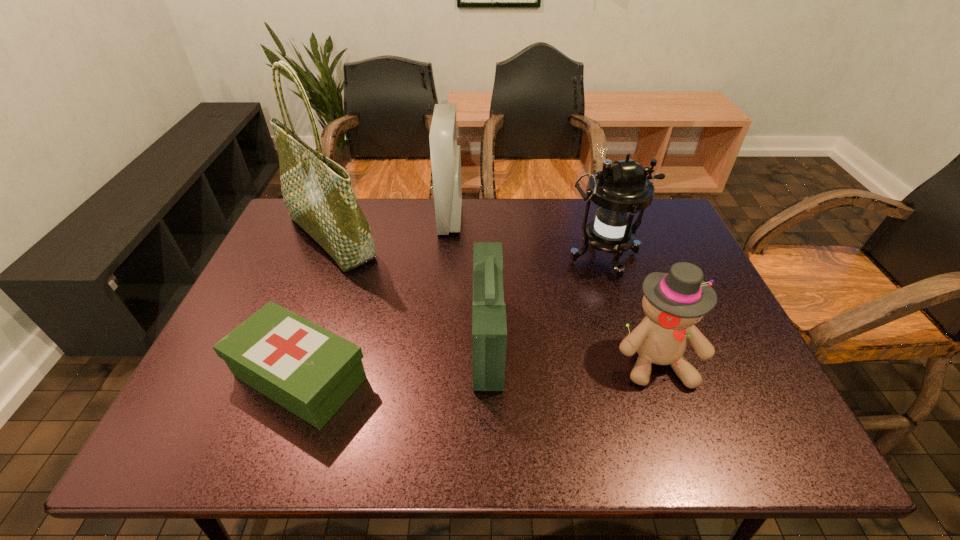
Where is `vacant space that is in between the third object from right to left and the rag_doll`? The image size is (960, 540). vacant space that is in between the third object from right to left and the rag_doll is located at coordinates (572, 350).

The width and height of the screenshot is (960, 540). In order to click on vacant point located between the tallest first-aid kit and the rag_doll in this screenshot , I will do `click(553, 289)`.

Locate which object ranks fifth in proximity to the shortest first-aid kit. Please provide its 2D coordinates. Your answer should be formatted as a tuple, i.e. [(x, y)], where the tuple contains the x and y coordinates of a point satisfying the conditions above.

[(673, 302)]

You are a GUI agent. You are given a task and a screenshot of the screen. Output one action in this format:
    pyautogui.click(x=<x>, y=<y>)
    Task: Click on the object that stands as the fourth closest to the second shortest first-aid kit
    This screenshot has width=960, height=540.
    Given the screenshot: What is the action you would take?
    pyautogui.click(x=445, y=153)

Choose which first-aid kit is the nearest neighbor to the second shortest first-aid kit. Please provide its 2D coordinates. Your answer should be formatted as a tuple, i.e. [(x, y)], where the tuple contains the x and y coordinates of a point satisfying the conditions above.

[(310, 371)]

This screenshot has width=960, height=540. I want to click on the first-aid kit that is the second closest to the farthest first-aid kit, so click(310, 371).

The width and height of the screenshot is (960, 540). I want to click on blank area in the image that satisfies the following two spatial constraints: 1. on the front-facing side of the third object from left to right; 2. on the front side of the shopping bag, so click(x=449, y=237).

The width and height of the screenshot is (960, 540). I want to click on free space that satisfies the following two spatial constraints: 1. on the front side of the tallest object; 2. on the left side of the lantern, so click(324, 258).

Find the location of a particular element. free space that satisfies the following two spatial constraints: 1. on the front-facing side of the second first-aid kit from right to left; 2. on the back side of the lantern is located at coordinates (447, 258).

You are a GUI agent. You are given a task and a screenshot of the screen. Output one action in this format:
    pyautogui.click(x=<x>, y=<y>)
    Task: Click on the free space that satisfies the following two spatial constraints: 1. on the front side of the lantern; 2. on the front-facing side of the second shortest first-aid kit
    
    Given the screenshot: What is the action you would take?
    pyautogui.click(x=630, y=341)